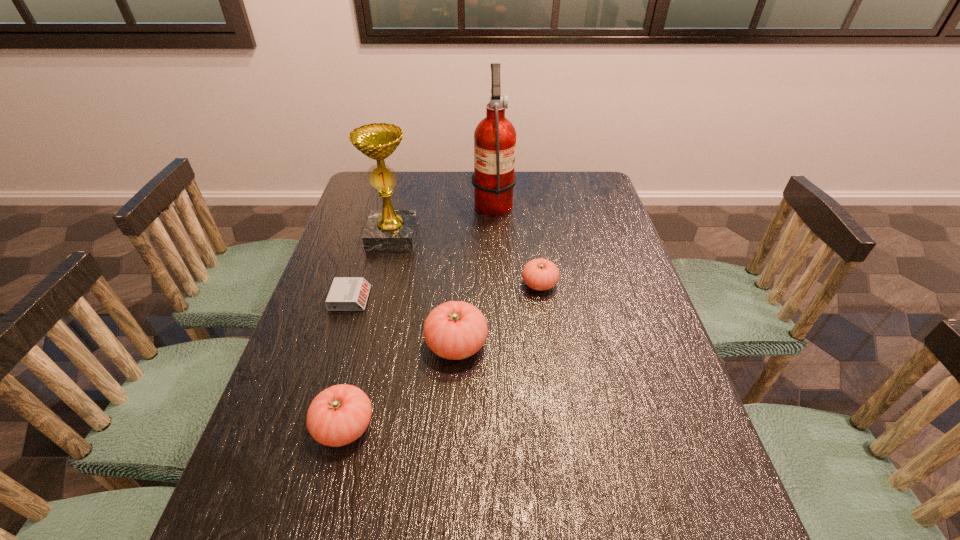
This screenshot has height=540, width=960. I want to click on object that stands as the second closest to the farthest object, so click(x=539, y=274).

Identify which tomato is located as the second nearest to the award. Please provide its 2D coordinates. Your answer should be formatted as a tuple, i.e. [(x, y)], where the tuple contains the x and y coordinates of a point satisfying the conditions above.

[(539, 274)]

The width and height of the screenshot is (960, 540). I want to click on tomato that can be found as the closest to the second tomato from right to left, so click(340, 414).

Locate an element on the screen. blank area in the image that satisfies the following two spatial constraints: 1. on the nozzle and handle of the second shortest object; 2. on the left side of the farthest object is located at coordinates (496, 284).

This screenshot has height=540, width=960. In order to click on vacant space that satisfies the following two spatial constraints: 1. on the nozzle and handle of the rightmost tomato; 2. on the left side of the fire extinguisher in this screenshot , I will do [x=496, y=284].

At what (x,y) coordinates should I click in order to perform the action: click on free space that satisfies the following two spatial constraints: 1. on the nozzle and handle of the farthest object; 2. on the front side of the nearest object. Please return your answer as a coordinate pair (x, y). Looking at the image, I should click on (502, 427).

Find the location of a particular element. This screenshot has height=540, width=960. vacant area that satisfies the following two spatial constraints: 1. on the front-facing side of the award; 2. on the left side of the farthest tomato is located at coordinates (380, 284).

You are a GUI agent. You are given a task and a screenshot of the screen. Output one action in this format:
    pyautogui.click(x=<x>, y=<y>)
    Task: Click on the vacant space that satisfies the following two spatial constraints: 1. on the back side of the alarm clock; 2. on the right side of the second shortest object
    The height and width of the screenshot is (540, 960).
    Given the screenshot: What is the action you would take?
    pyautogui.click(x=354, y=284)

I want to click on free location that satisfies the following two spatial constraints: 1. on the back side of the fifth tallest object; 2. on the left side of the nearest object, so click(379, 284).

Where is `blank space that satisfies the following two spatial constraints: 1. on the nozzle and handle of the tallest object; 2. on the front-facing side of the second farthest object`? Image resolution: width=960 pixels, height=540 pixels. blank space that satisfies the following two spatial constraints: 1. on the nozzle and handle of the tallest object; 2. on the front-facing side of the second farthest object is located at coordinates (494, 236).